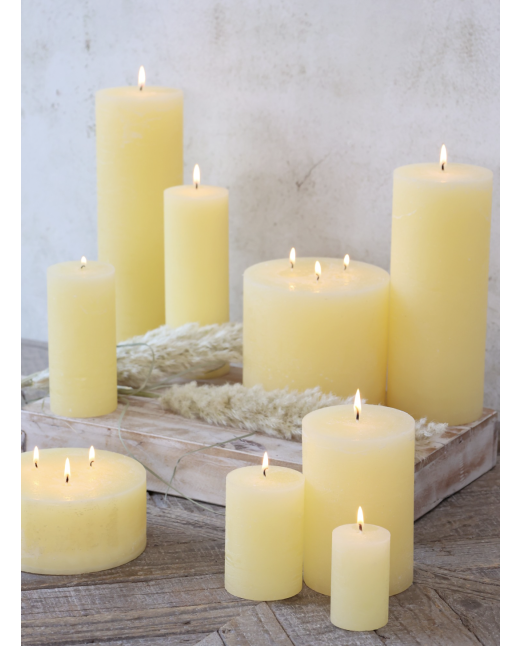
You are a GUI agent. You are given a task and a screenshot of the screen. Output one action in this format:
    pyautogui.click(x=<x>, y=<y>)
    Task: Click on the taller candles
    
    Given the screenshot: What is the action you would take?
    pyautogui.click(x=136, y=160), pyautogui.click(x=212, y=233), pyautogui.click(x=458, y=216), pyautogui.click(x=95, y=331), pyautogui.click(x=392, y=450)